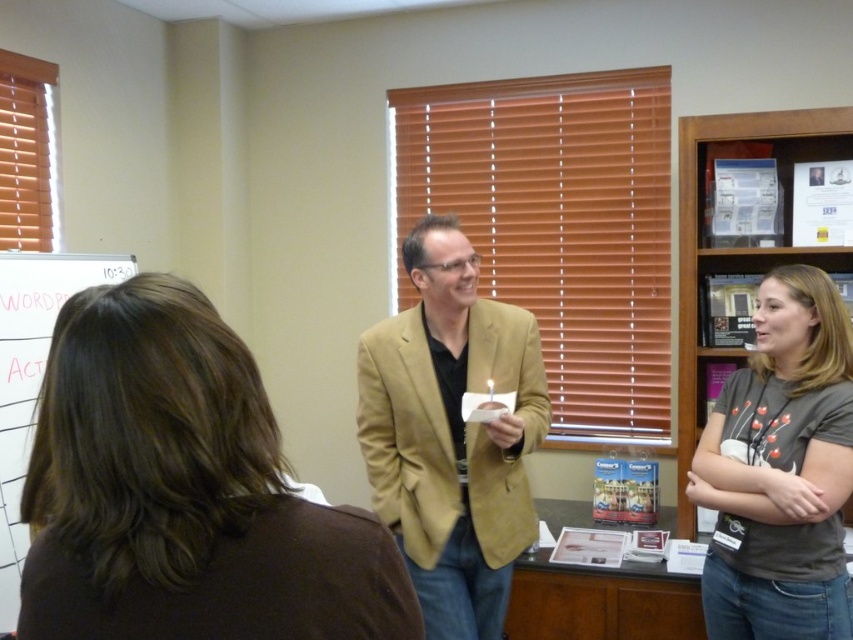
You are a delivery person who needs to place a package between the matte gold blazer at center and the white grid paper at upper left. The package requires 4 feet of space. Can you fit it between them?

The distance between the matte gold blazer at center and the white grid paper at upper left is 3.82 feet, which is less than the required 4 feet. Therefore, the package cannot be placed between them.